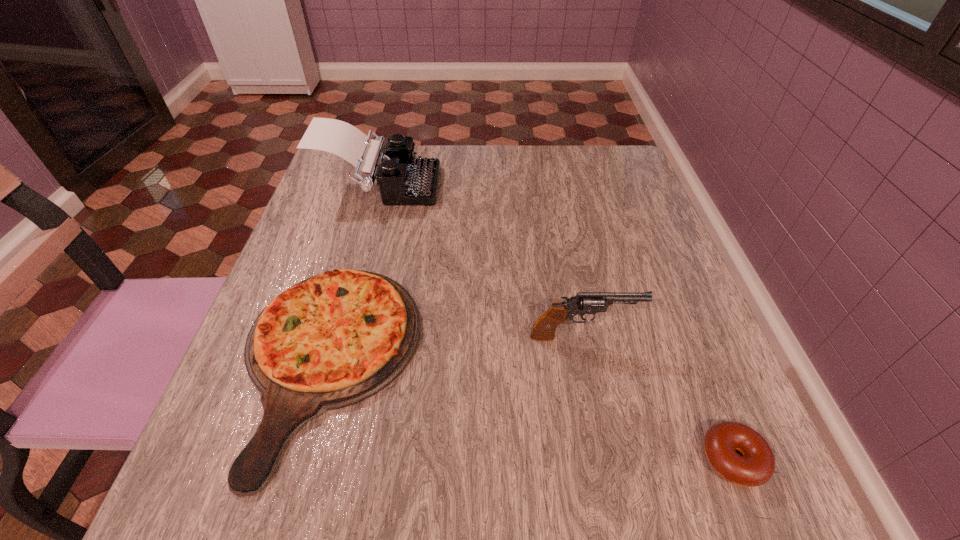
This screenshot has width=960, height=540. I want to click on vacant region located on the left of the rightmost object, so click(616, 458).

Locate an element on the screen. This screenshot has height=540, width=960. object present at the far edge is located at coordinates (403, 179).

Where is `pizza that is positioned at the near edge`? The image size is (960, 540). pizza that is positioned at the near edge is located at coordinates (333, 340).

In order to click on doughnut at the near edge in this screenshot , I will do `click(756, 466)`.

In order to click on typewriter that is at the left edge in this screenshot , I will do `click(403, 179)`.

Locate an element on the screen. This screenshot has width=960, height=540. pizza situated at the left edge is located at coordinates (333, 340).

Locate an element on the screen. gun that is positioned at the right edge is located at coordinates (544, 328).

Identify the location of doughnut that is positioned at the right edge. The height and width of the screenshot is (540, 960). (756, 466).

In order to click on object present at the far left corner in this screenshot , I will do `click(403, 179)`.

Find the location of a particular element. This screenshot has height=540, width=960. object present at the near left corner is located at coordinates (333, 340).